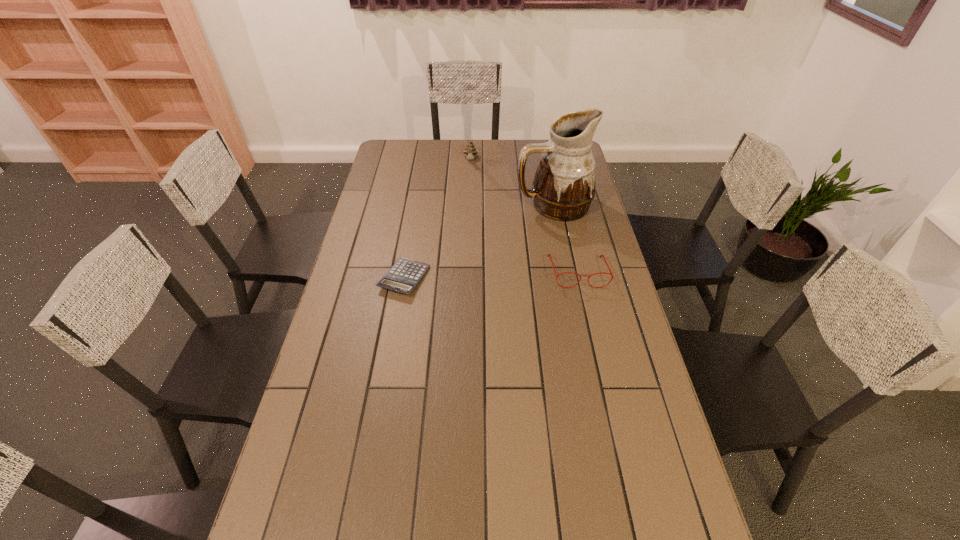
What are the coordinates of `blank space at the near edge` in the screenshot? It's located at (525, 499).

Locate an element on the screen. The width and height of the screenshot is (960, 540). free space at the left edge of the desktop is located at coordinates (397, 171).

In the image, there is a desktop. Where is `vacant space at the right edge`? This screenshot has height=540, width=960. vacant space at the right edge is located at coordinates (638, 402).

In the image, there is a desktop. Where is `free space at the near right corner`? This screenshot has height=540, width=960. free space at the near right corner is located at coordinates (624, 518).

The image size is (960, 540). I want to click on free space that is in between the farthest object and the tallest object, so click(x=512, y=183).

The image size is (960, 540). Find the location of `empty space between the tallest object and the second shortest object`. empty space between the tallest object and the second shortest object is located at coordinates click(x=565, y=239).

I want to click on free point between the shortest object and the snail, so click(x=438, y=219).

Identify the location of vacant area between the spectacles and the pitcher. (565, 239).

I want to click on free area in between the tallest object and the second object from left to right, so click(x=512, y=183).

At what (x,y) coordinates should I click in order to perform the action: click on free space between the second tallest object and the shortest object. Please return your answer as a coordinate pair (x, y). This screenshot has height=540, width=960. Looking at the image, I should click on (438, 219).